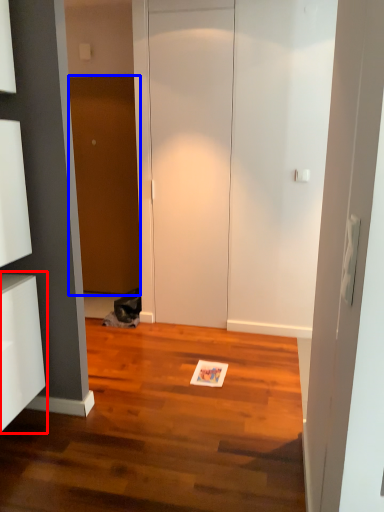
Question: Which point is closer to the camera, cabinetry (highlighted by a red box) or door (highlighted by a blue box)?

Choices:
 (A) cabinetry
 (B) door

Answer: (A)